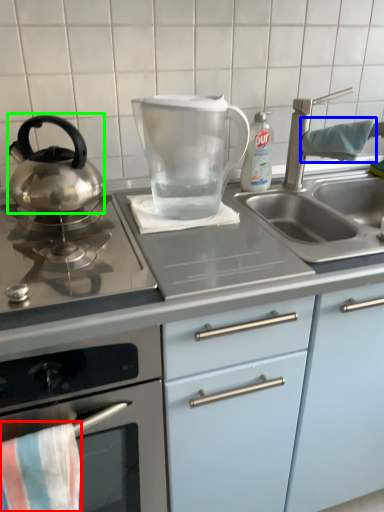
Question: Based on their relative distances, which object is farther from beach towel (highlighted by a red box)? Choose from beach towel (highlighted by a blue box) and kitchen appliance (highlighted by a green box).

Choices:
 (A) beach towel
 (B) kitchen appliance

Answer: (A)